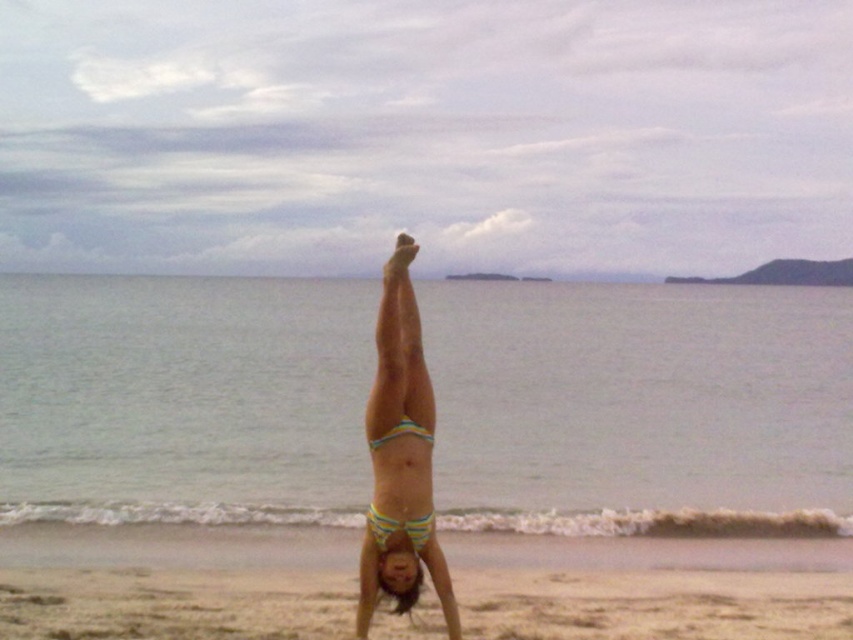
You are a photographer taking a picture of the beach scene. You notice two bikinis at the center of the image. Which one is the yellow striped bikini at center in relation to the striped fabric bikini at center?

The yellow striped bikini at center is closer to the viewer than the striped fabric bikini at center.